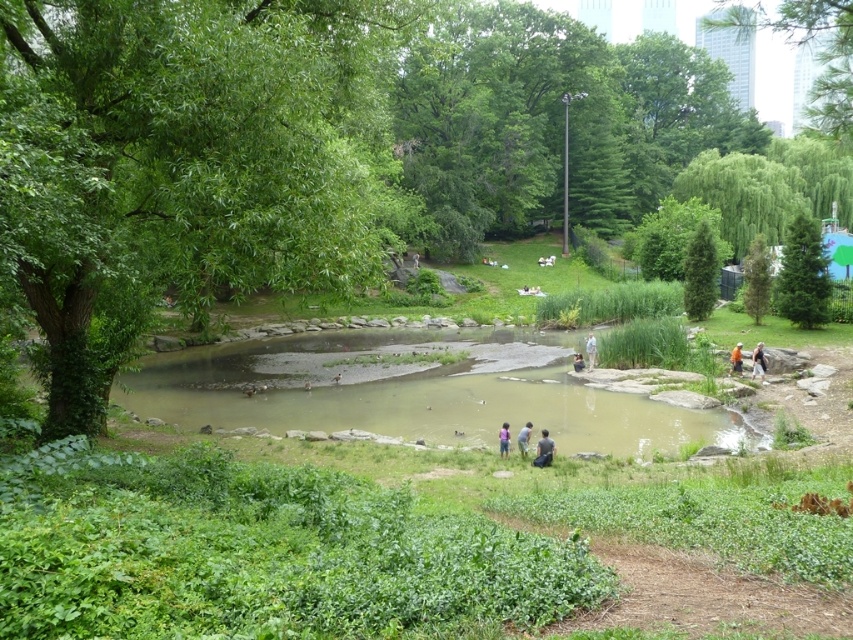
Between point (190, 58) and point (705, 300), which one is positioned behind?

The point (705, 300) is behind.

Who is lower down, green leafy tree at left or green textured tree at upper right?

green textured tree at upper right is below.

The height and width of the screenshot is (640, 853). What are the coordinates of `green leafy tree at left` in the screenshot? It's located at (189, 163).

At what (x,y) coordinates should I click in order to perform the action: click on green leafy tree at left. Please return your answer as a coordinate pair (x, y). The image size is (853, 640). Looking at the image, I should click on (189, 163).

Is green mossy rocks at center wider than light brown leather jacket at center?

Correct, the width of green mossy rocks at center exceeds that of light brown leather jacket at center.

Who is higher up, green mossy rocks at center or light brown leather jacket at center?

green mossy rocks at center is above.

Image resolution: width=853 pixels, height=640 pixels. I want to click on green mossy rocks at center, so click(x=416, y=394).

Locate an element on the screen. The width and height of the screenshot is (853, 640). green mossy rocks at center is located at coordinates (416, 394).

Is green leafy tree at left wider than green mossy rocks at center?

No.

Is point (0, 8) positioned after point (289, 364)?

No, it is not.

Who is more distant from viewer, (55, 369) or (428, 440)?

The point (428, 440) is more distant.

Find the location of a particular element. The width and height of the screenshot is (853, 640). green leafy tree at left is located at coordinates (189, 163).